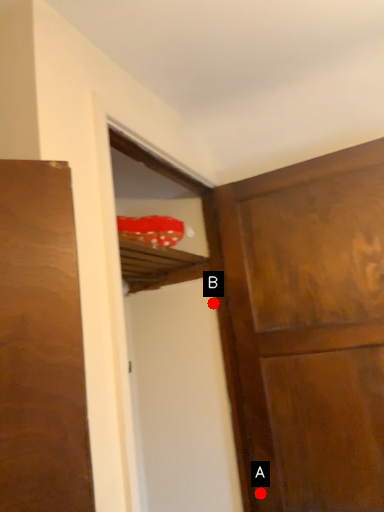
Question: Two points are circled on the image, labeled by A and B beside each circle. Which point appears closest to the camera in this image?

Choices:
 (A) A is closer
 (B) B is closer

Answer: (A)